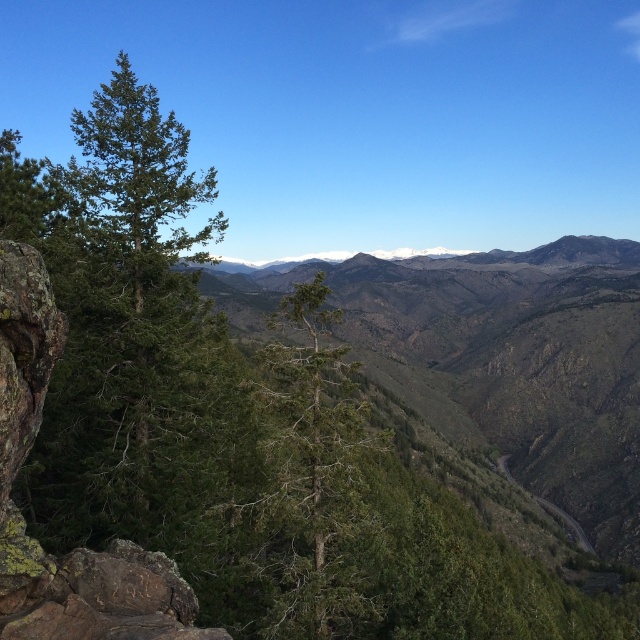
You are a hiker who wants to take a photo of the green textured tree at center. You notice the green matte tree at left is blocking your view. Can you move to the right to get a clear shot?

The green matte tree at left is positioned on the left side of green textured tree at center. Moving to the right might allow you to see around the green matte tree at left and get a clear view of the green textured tree at center.

You are a hiker planning to take a photo of the green matte tree at left and the green textured tree at center. Which tree should you stand closer to in order to capture both trees in the same frame without zooming in?

You should stand closer to the green textured tree at center because it is shorter than the green matte tree at left, allowing both to fit in the frame when positioned nearer to the shorter tree.